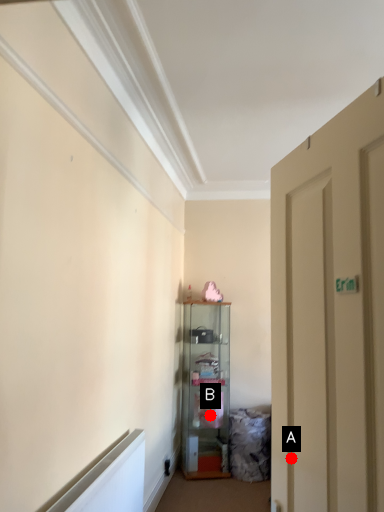
Question: Two points are circled on the image, labeled by A and B beside each circle. Which point is closer to the camera?

Choices:
 (A) A is closer
 (B) B is closer

Answer: (A)